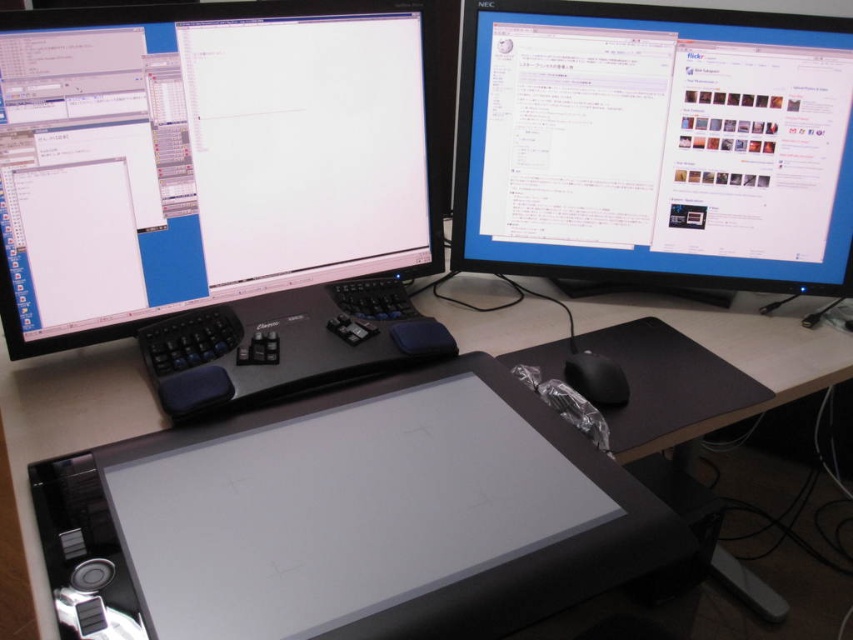
You are a remote worker who needs to reach the black matte mouse at lower right without touching the matte black monitor at upper right. Can you do this easily?

The matte black monitor at upper right is positioned over the black matte mouse at lower right, so reaching the mouse might be difficult as the monitor may block access.

You are setting up a new monitor and mouse for your home office. The matte black monitor at upper left needs to be placed on the desk next to the black matte mouse at lower right. Based on the existing setup shown in the image, which object should be positioned to the left side of the desk?

The matte black monitor at upper left should be positioned to the left side of the desk since it is larger in size than the black matte mouse at lower right, making it more suitable for placement on the left where there is likely more space.

You are a delivery person who needs to place a new 17.5 inch wide package between the matte black monitor at upper left and the black plastic computer desk at center. Can the package fit in the space between them?

The space between the matte black monitor at upper left and the black plastic computer desk at center is 17.37 inches. Since the package is 17.5 inches wide, it is slightly wider than the available space. Therefore, the package cannot fit between them.